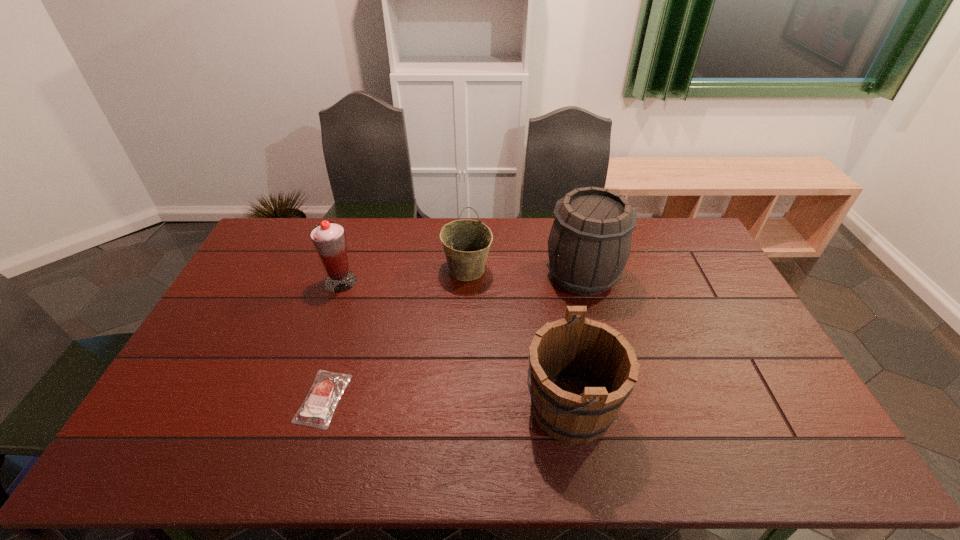
The height and width of the screenshot is (540, 960). Identify the location of smoothie. point(329,239).

You are a GUI agent. You are given a task and a screenshot of the screen. Output one action in this format:
    pyautogui.click(x=<x>, y=<y>)
    Task: Click on the third object from right to left
    Image resolution: width=960 pixels, height=540 pixels.
    Given the screenshot: What is the action you would take?
    pyautogui.click(x=466, y=243)

At what (x,y) coordinates should I click in order to perform the action: click on the nearest wine bucket. Please return your answer as a coordinate pair (x, y). Looking at the image, I should click on (581, 371).

You are a GUI agent. You are given a task and a screenshot of the screen. Output one action in this format:
    pyautogui.click(x=<x>, y=<y>)
    Task: Click on the steak
    This screenshot has height=540, width=960.
    Given the screenshot: What is the action you would take?
    pyautogui.click(x=318, y=407)

You are a GUI agent. You are given a task and a screenshot of the screen. Output one action in this format:
    pyautogui.click(x=<x>, y=<y>)
    Task: Click on the blank space located on the back of the smoothie
    The image size is (960, 540).
    Given the screenshot: What is the action you would take?
    pyautogui.click(x=352, y=248)

Where is `vacant region located 0.080m on the left of the leftmost wine bucket`? Image resolution: width=960 pixels, height=540 pixels. vacant region located 0.080m on the left of the leftmost wine bucket is located at coordinates (420, 270).

Image resolution: width=960 pixels, height=540 pixels. What are the coordinates of `vacant position located 0.310m on the side of the nearest wine bucket with the handle for carrying` in the screenshot? It's located at (x=404, y=408).

Locate an element on the screen. The width and height of the screenshot is (960, 540). vacant region located 0.060m on the side of the nearest wine bucket with the handle for carrying is located at coordinates tap(501, 408).

You are a GUI agent. You are given a task and a screenshot of the screen. Output one action in this format:
    pyautogui.click(x=<x>, y=<y>)
    Task: Click on the free spot located on the side of the nearest wine bucket with the handle for carrying
    The image size is (960, 540).
    Given the screenshot: What is the action you would take?
    pyautogui.click(x=443, y=408)

Find the location of a particular element. This screenshot has width=960, height=540. vacant area located 0.070m on the front of the shortest object is located at coordinates (305, 458).